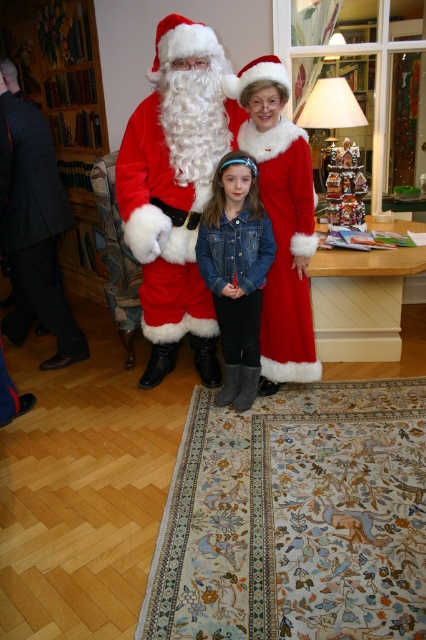
At what (x,y) coordinates should I click in order to perform the action: click on velvet red santa at center. Please return your answer as a coordinate pair (x, y). The image size is (426, 640). Looking at the image, I should click on (175, 192).

Consider the image. Can you confirm if velvet red santa at center is positioned to the left of dark gray suit at left?

No, velvet red santa at center is not to the left of dark gray suit at left.

At what (x,y) coordinates should I click in order to perform the action: click on velvet red santa at center. Please return your answer as a coordinate pair (x, y). The width and height of the screenshot is (426, 640). Looking at the image, I should click on (175, 192).

Identify the location of velvet red santa at center. (175, 192).

Can you confirm if velvet red santa at center is bigger than velvet red dress at center?

Yes.

Is velvet red santa at center taller than velvet red dress at center?

Indeed, velvet red santa at center has a greater height compared to velvet red dress at center.

You are a GUI agent. You are given a task and a screenshot of the screen. Output one action in this format:
    pyautogui.click(x=<x>, y=<y>)
    Task: Click on the velvet red santa at center
    
    Given the screenshot: What is the action you would take?
    pyautogui.click(x=175, y=192)

The image size is (426, 640). Find the location of `velvet red santa at center`. velvet red santa at center is located at coordinates (175, 192).

Can you confirm if velvet red dress at center is positioned above denim jacket at center?

Yes, velvet red dress at center is above denim jacket at center.

Image resolution: width=426 pixels, height=640 pixels. I want to click on velvet red dress at center, so click(x=285, y=248).

Where is `velvet red dress at center`? This screenshot has height=640, width=426. velvet red dress at center is located at coordinates (285, 248).